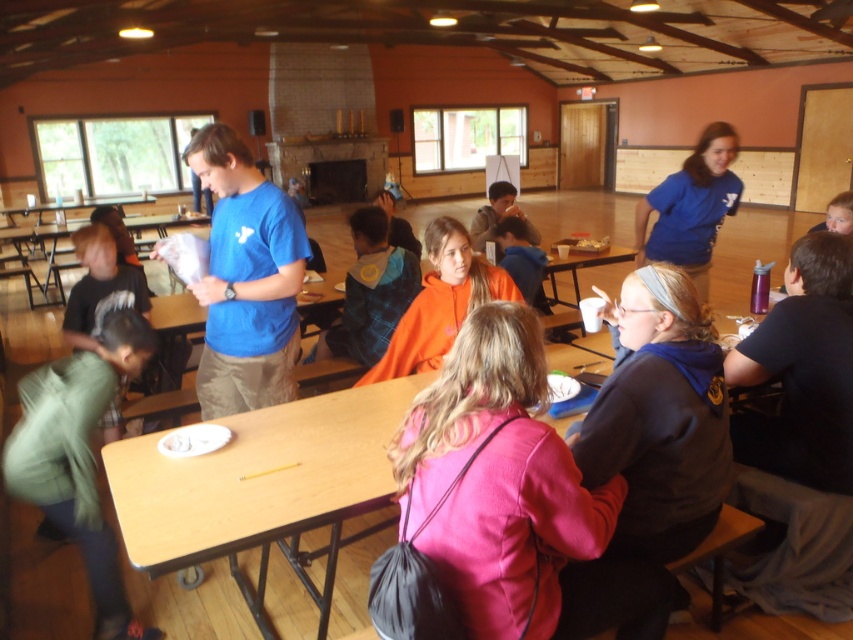
Question: Is pink fabric jacket at center to the right of flannel shirt at center from the viewer's perspective?

Choices:
 (A) yes
 (B) no

Answer: (A)

Question: Which point is closer to the camera taking this photo?

Choices:
 (A) (233, 524)
 (B) (30, 428)
 (C) (416, 284)

Answer: (A)

Question: Which object is positioned closest to the blue cotton shirt at center?

Choices:
 (A) green cotton pants at lower left
 (B) pink fabric jacket at center
 (C) wooden table at center
 (D) flannel shirt at center

Answer: (A)

Question: Which object appears closest to the camera in this image?

Choices:
 (A) wooden table at center
 (B) pink fabric jacket at center

Answer: (B)

Question: Is pink fabric jacket at center smaller than wooden table at center?

Choices:
 (A) no
 (B) yes

Answer: (B)

Question: Does pink fabric jacket at center have a smaller size compared to blue cotton shirt at center?

Choices:
 (A) yes
 (B) no

Answer: (A)